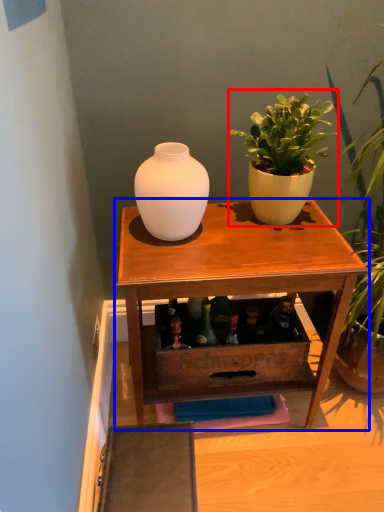
Question: Which point is closer to the camera, houseplant (highlighted by a red box) or table (highlighted by a blue box)?

Choices:
 (A) houseplant
 (B) table

Answer: (A)